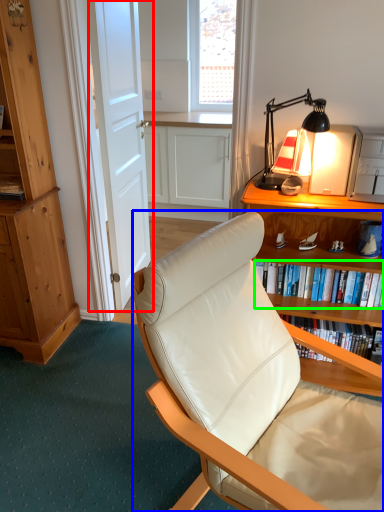
Question: Based on their relative distances, which object is nearer to door (highlighted by a red box)? Choose from chair (highlighted by a blue box) and book (highlighted by a green box).

Choices:
 (A) chair
 (B) book

Answer: (B)